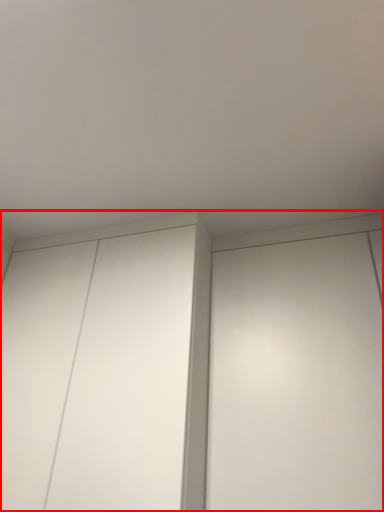
Question: From the image's perspective, where is cupboard (annotated by the red box) located relative to elevator?

Choices:
 (A) below
 (B) above

Answer: (A)